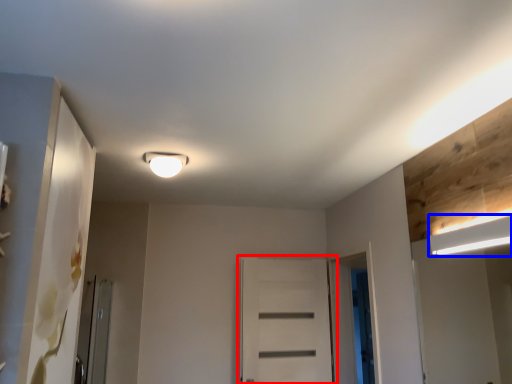
Question: Which object appears closest to the camera in this image, door (highlighted by a red box) or lamp (highlighted by a blue box)?

Choices:
 (A) door
 (B) lamp

Answer: (B)